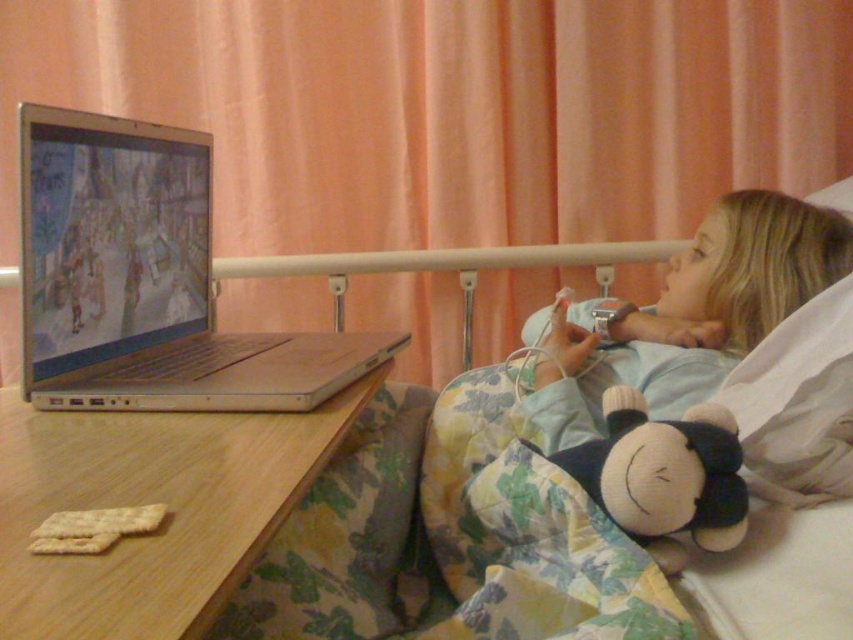
Is fluffy fabric bed at center bigger than light blue fabric at upper right?

Indeed, fluffy fabric bed at center has a larger size compared to light blue fabric at upper right.

Between point (593, 365) and point (737, 204), which one is positioned behind?

Positioned behind is point (737, 204).

Is point (671, 384) positioned after point (670, 337)?

No, it is not.

Locate an element on the screen. This screenshot has height=640, width=853. fluffy fabric bed at center is located at coordinates (450, 536).

Who is taller, fluffy fabric bed at center or silver metallic laptop at left?

silver metallic laptop at left is taller.

Which of these two, fluffy fabric bed at center or silver metallic laptop at left, stands shorter?

fluffy fabric bed at center

Is point (403, 545) more distant than point (187, 266)?

No, (403, 545) is in front of (187, 266).

You are a GUI agent. You are given a task and a screenshot of the screen. Output one action in this format:
    pyautogui.click(x=<x>, y=<y>)
    Task: Click on the fluffy fabric bed at center
    Image resolution: width=853 pixels, height=640 pixels.
    Given the screenshot: What is the action you would take?
    pyautogui.click(x=450, y=536)

Between silver metallic laptop at left and soft fabric monkey at lower right, which one is positioned higher?

silver metallic laptop at left

Which is more to the left, silver metallic laptop at left or soft fabric monkey at lower right?

Positioned to the left is silver metallic laptop at left.

Is point (357, 355) behind point (685, 445)?

Yes, point (357, 355) is behind point (685, 445).

Locate an element on the screen. silver metallic laptop at left is located at coordinates (146, 282).